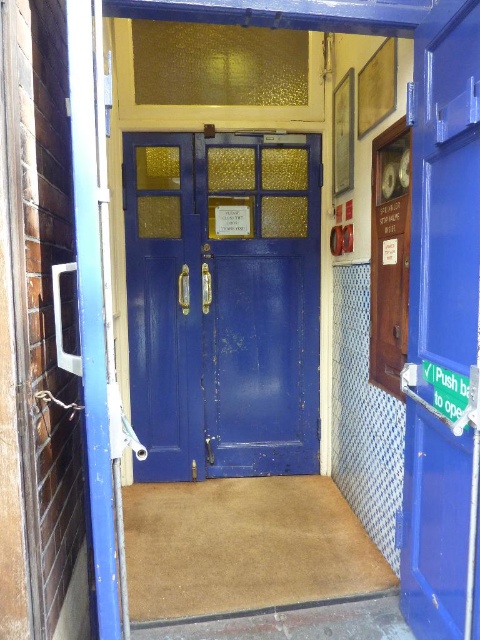
Question: Which point is closer to the camera taking this photo?

Choices:
 (A) (431, 397)
 (B) (192, 419)

Answer: (A)

Question: Which of the following is the farthest from the observer?

Choices:
 (A) matte blue door at right
 (B) matte blue door at center

Answer: (B)

Question: Does matte blue door at center have a larger size compared to matte blue door at right?

Choices:
 (A) no
 (B) yes

Answer: (B)

Question: Can you confirm if matte blue door at center is positioned above matte blue door at right?

Choices:
 (A) yes
 (B) no

Answer: (A)

Question: Among these points, which one is nearest to the camera?

Choices:
 (A) (465, 241)
 (B) (176, 212)

Answer: (A)

Question: Is matte blue door at center wider than matte blue door at right?

Choices:
 (A) no
 (B) yes

Answer: (B)